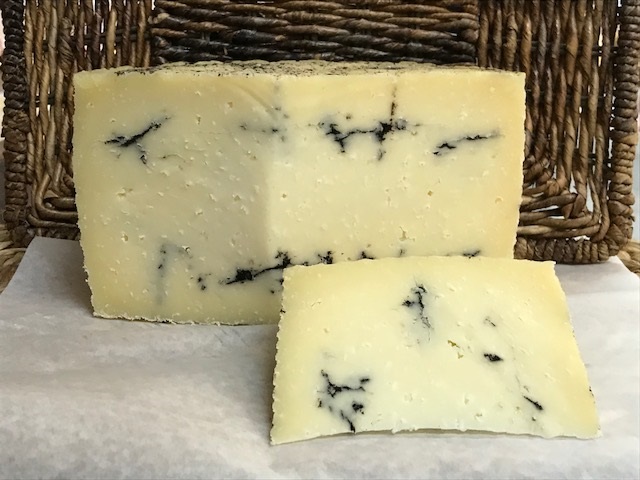
You are a GUI agent. You are given a task and a screenshot of the screen. Output one action in this format:
    pyautogui.click(x=<x>, y=<y>)
    Task: Click on the basket
    
    Given the screenshot: What is the action you would take?
    pyautogui.click(x=619, y=128)